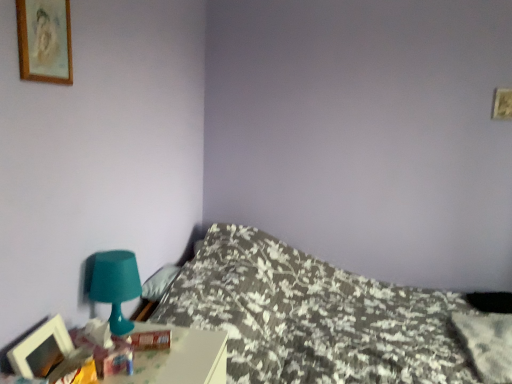
Question: Which direction should I rotate to look at fluffy white pillow at center, the second pillow viewed from the left?

Choices:
 (A) left
 (B) right

Answer: (B)

Question: From the image's perspective, would you say fluffy white pillow at center, the second pillow viewed from the left, is positioned over wooden picture frame at lower left, arranged as the 1th picture frame when ordered from the bottom?

Choices:
 (A) no
 (B) yes

Answer: (A)

Question: Can you confirm if fluffy white pillow at center, the second pillow positioned from the top, is shorter than wooden picture frame at lower left, arranged as the 1th picture frame when ordered from the bottom?

Choices:
 (A) yes
 (B) no

Answer: (A)

Question: Considering the relative sizes of fluffy white pillow at center, the second pillow positioned from the top, and wooden picture frame at lower left, arranged as the 1th picture frame when ordered from the bottom, in the image provided, is fluffy white pillow at center, the second pillow positioned from the top, taller than wooden picture frame at lower left, arranged as the 1th picture frame when ordered from the bottom,?

Choices:
 (A) yes
 (B) no

Answer: (B)

Question: Is fluffy white pillow at center, the 1th pillow positioned from the bottom, positioned far away from wooden picture frame at lower left, arranged as the 1th picture frame when ordered from the bottom?

Choices:
 (A) yes
 (B) no

Answer: (A)

Question: Can we say fluffy white pillow at center, the second pillow positioned from the top, lies outside wooden picture frame at lower left, arranged as the 2th picture frame when viewed from the top?

Choices:
 (A) no
 (B) yes

Answer: (B)

Question: From a real-world perspective, is fluffy white pillow at center, the second pillow positioned from the top, over wooden picture frame at lower left, arranged as the 1th picture frame when ordered from the bottom?

Choices:
 (A) no
 (B) yes

Answer: (A)

Question: Considering the relative positions of teal plastic table lamp at lower left and wooden-framed painting at upper left, the first picture frame viewed from the top, in the image provided, is teal plastic table lamp at lower left to the left of wooden-framed painting at upper left, the first picture frame viewed from the top, from the viewer's perspective?

Choices:
 (A) no
 (B) yes

Answer: (A)

Question: Is teal plastic table lamp at lower left shorter than wooden-framed painting at upper left, the first picture frame viewed from the top?

Choices:
 (A) yes
 (B) no

Answer: (B)

Question: Considering the relative sizes of teal plastic table lamp at lower left and wooden-framed painting at upper left, the 2th picture frame in the bottom-to-top sequence, in the image provided, is teal plastic table lamp at lower left bigger than wooden-framed painting at upper left, the 2th picture frame in the bottom-to-top sequence,?

Choices:
 (A) no
 (B) yes

Answer: (B)

Question: From the image's perspective, is teal plastic table lamp at lower left beneath wooden-framed painting at upper left, the 2th picture frame in the bottom-to-top sequence?

Choices:
 (A) yes
 (B) no

Answer: (A)

Question: Is teal plastic table lamp at lower left facing towards wooden-framed painting at upper left, the 2th picture frame in the bottom-to-top sequence?

Choices:
 (A) yes
 (B) no

Answer: (B)

Question: Is teal plastic table lamp at lower left not close to wooden-framed painting at upper left, the 2th picture frame in the bottom-to-top sequence?

Choices:
 (A) yes
 (B) no

Answer: (B)

Question: From a real-world perspective, is wooden-framed painting at upper left, the first picture frame viewed from the top, on top of fluffy white pillow at upper left, marked as the first pillow in a left-to-right arrangement?

Choices:
 (A) no
 (B) yes

Answer: (B)